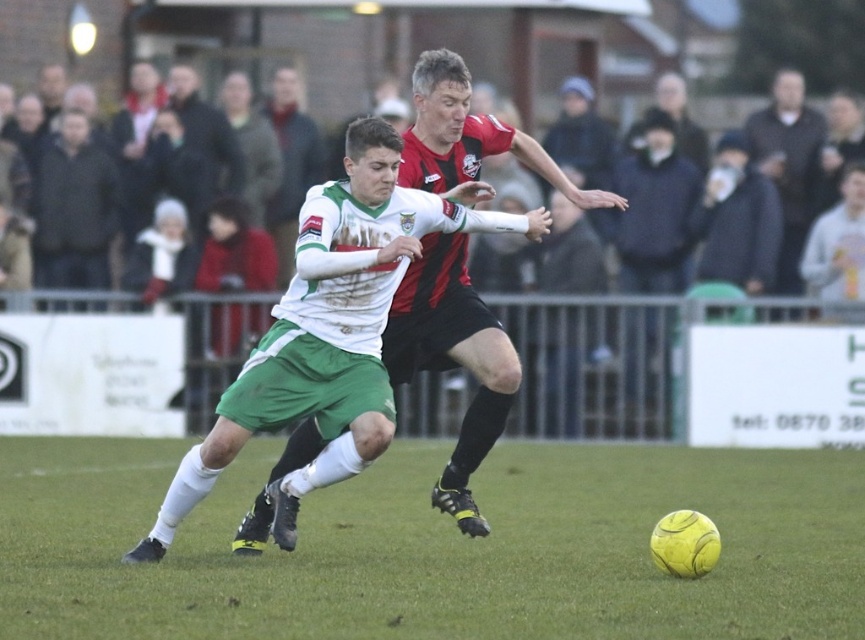
Who is shorter, yellow rubber ball at center or white jersey at center?

With less height is yellow rubber ball at center.

Which is more to the left, yellow rubber ball at center or white jersey at center?

Positioned to the left is yellow rubber ball at center.

At what (x,y) coordinates should I click in order to perform the action: click on yellow rubber ball at center. Please return your answer as a coordinate pair (x, y). The height and width of the screenshot is (640, 865). Looking at the image, I should click on (434, 545).

Which is more to the left, white jersey at center or dark gray jacket at upper left?

dark gray jacket at upper left is more to the left.

Can you confirm if white jersey at center is taller than dark gray jacket at upper left?

Incorrect, white jersey at center's height is not larger of dark gray jacket at upper left's.

The image size is (865, 640). In order to click on white jersey at center in this screenshot , I will do `click(452, 358)`.

Does yellow rubber ball at center appear over dark gray jacket at upper left?

Actually, yellow rubber ball at center is below dark gray jacket at upper left.

Between yellow rubber ball at center and dark gray jacket at upper left, which one is positioned higher?

dark gray jacket at upper left is above.

This screenshot has height=640, width=865. Describe the element at coordinates (434, 545) in the screenshot. I see `yellow rubber ball at center` at that location.

The image size is (865, 640). Identify the location of yellow rubber ball at center. (434, 545).